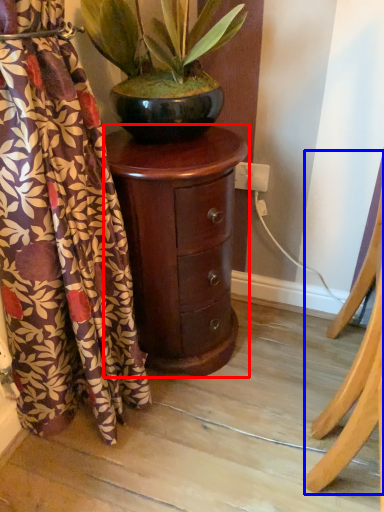
Question: Which of the following is the closest to the observer, nightstand (highlighted by a red box) or furniture (highlighted by a blue box)?

Choices:
 (A) nightstand
 (B) furniture

Answer: (B)